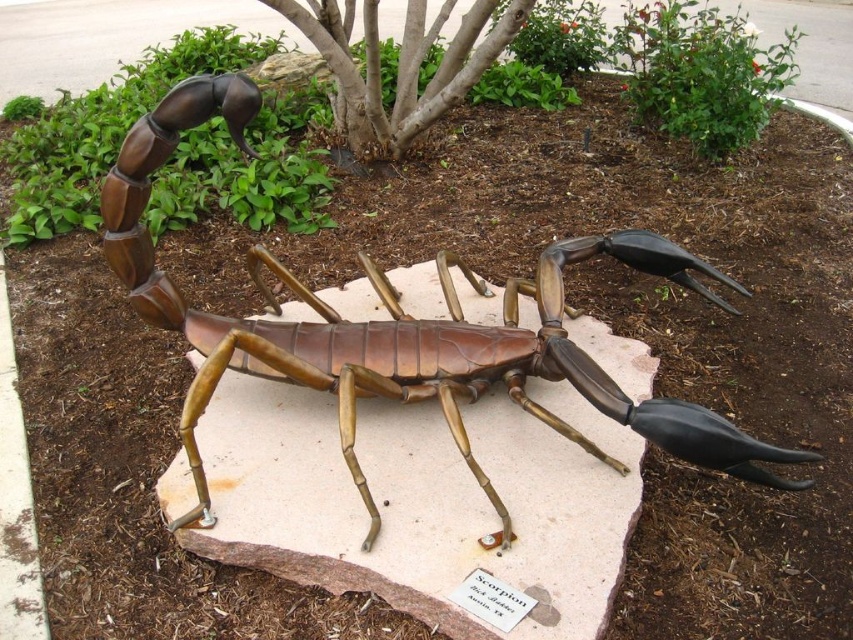
Question: Is bronze metallic scorpion at center thinner than brown bark tree at center?

Choices:
 (A) no
 (B) yes

Answer: (A)

Question: Is bronze metallic scorpion at center closer to the viewer compared to brown bark tree at center?

Choices:
 (A) yes
 (B) no

Answer: (A)

Question: Which point appears farthest from the camera in this image?

Choices:
 (A) (444, 100)
 (B) (138, 180)

Answer: (A)

Question: Is bronze metallic scorpion at center above brown bark tree at center?

Choices:
 (A) yes
 (B) no

Answer: (B)